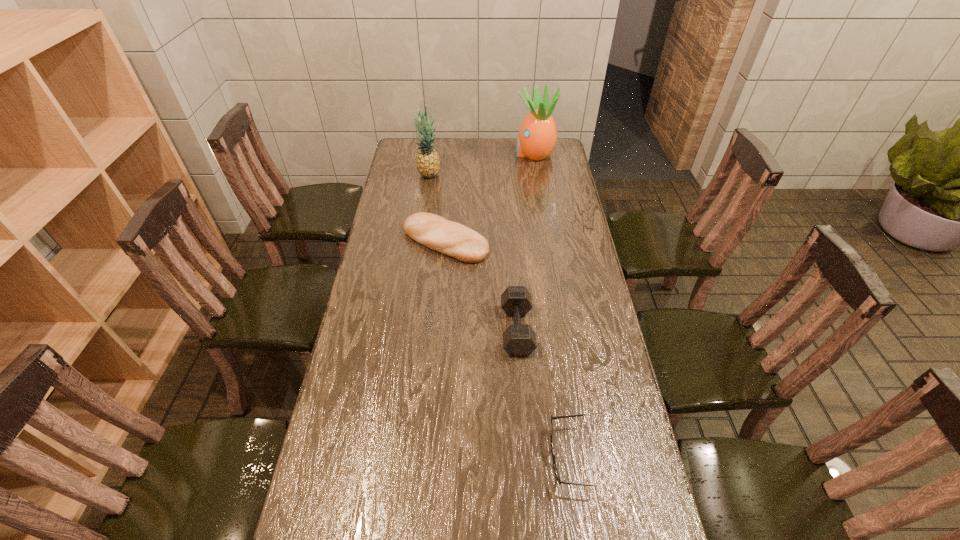
The image size is (960, 540). Identify the location of vacant point located between the dumbbell and the bread. (481, 286).

You are a GUI agent. You are given a task and a screenshot of the screen. Output one action in this format:
    pyautogui.click(x=<x>, y=<y>)
    Task: Click on the free space between the right pineapple and the dumbbell
    The width and height of the screenshot is (960, 540).
    Given the screenshot: What is the action you would take?
    pyautogui.click(x=525, y=241)

Locate an element on the screen. The height and width of the screenshot is (540, 960). free space between the nearer pineapple and the farthest object is located at coordinates (481, 164).

You are a GUI agent. You are given a task and a screenshot of the screen. Output one action in this format:
    pyautogui.click(x=<x>, y=<y>)
    Task: Click on the object that stands as the third closest to the third farthest object
    
    Given the screenshot: What is the action you would take?
    pyautogui.click(x=537, y=137)

Locate an element on the screen. Image resolution: width=960 pixels, height=540 pixels. object that stands as the second closest to the nearest object is located at coordinates (450, 238).

This screenshot has width=960, height=540. Find the location of `vacant space that satisfies the following two spatial constraints: 1. at the entrance of the farthest object; 2. on the front side of the fourth farthest object`. vacant space that satisfies the following two spatial constraints: 1. at the entrance of the farthest object; 2. on the front side of the fourth farthest object is located at coordinates (562, 330).

Where is `free spot that satisfies the following two spatial constraints: 1. at the entrance of the farther pineapple; 2. on the front side of the dumbbell`? This screenshot has width=960, height=540. free spot that satisfies the following two spatial constraints: 1. at the entrance of the farther pineapple; 2. on the front side of the dumbbell is located at coordinates (562, 330).